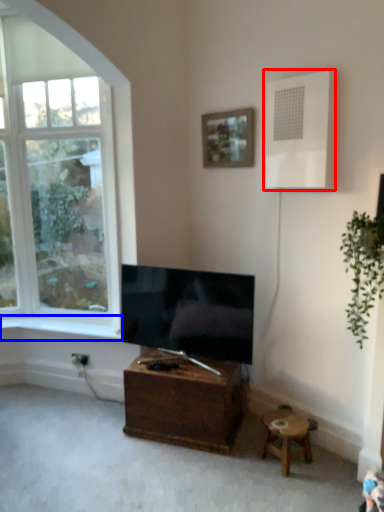
Question: Which of the following is the farthest to the observer, air conditioner (highlighted by a red box) or window sill (highlighted by a blue box)?

Choices:
 (A) air conditioner
 (B) window sill

Answer: (B)